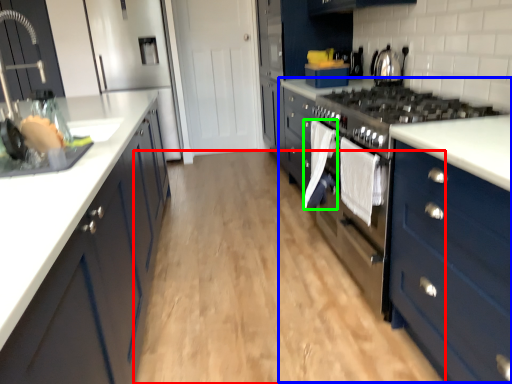
Question: Which object is the closest to the plain (highlighted by a red box)? Choose among these: dresser (highlighted by a blue box) or clothe (highlighted by a green box).

Choices:
 (A) dresser
 (B) clothe

Answer: (A)